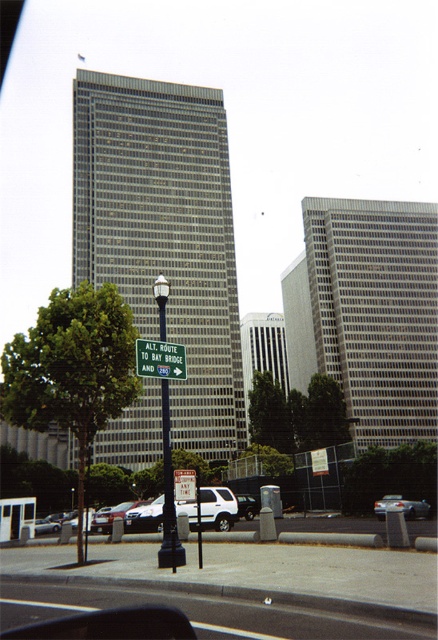
You are standing at the intersection and need to locate the black metal pole at center. What are the coordinates where you should look?

The black metal pole at center is located at coordinates point (x=169, y=496).

You are a delivery driver navigating through the city and see the green directional sign on the black lamppost. There are two points marked on your GPS map at coordinates point (x=136, y=500) and point (x=222, y=486). According to the scene, which point is closer to the lamppost?

Point (x=222, y=486) is closer to the lamppost because it is in front of point (x=136, y=500), which is behind it.

You are a drone operator trying to navigate between two points in the image. You need to fly from point A to point B. If point A is point (406, 513) and point B is point (226, 492), will you have to ascend or descend while moving from A to B?

Point A is further to the camera than point B. Therefore, moving from A to B requires descending.